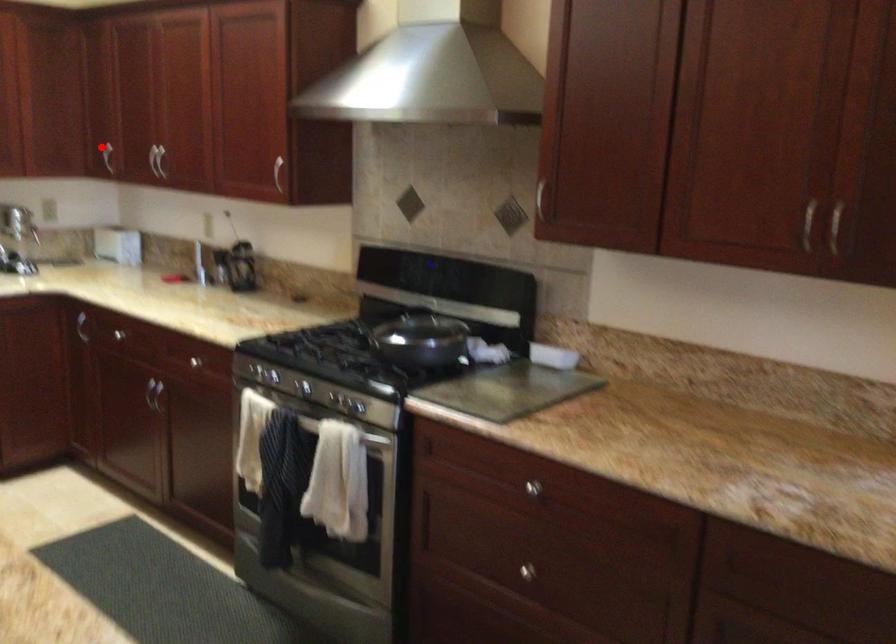
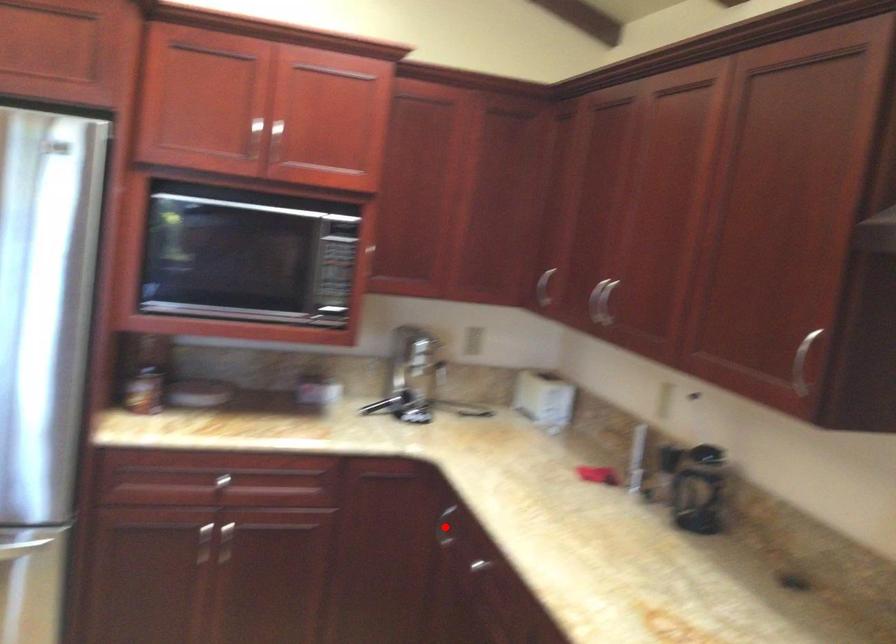
I am providing you with two images of the same scene from different viewpoints. A red point is marked on the first image and another point is marked on the second image. Is the marked point in image1 the same physical position as the marked point in image2?

No